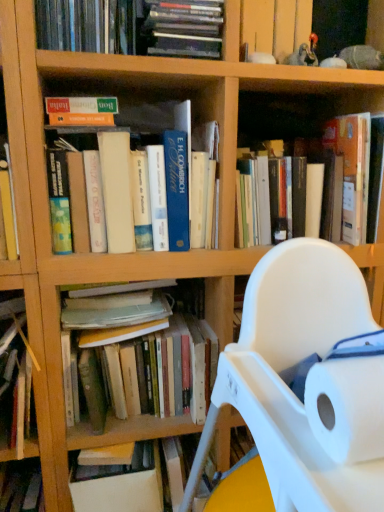
Question: Does hardcover books at upper center, the 6th book from the bottom, have a lesser height compared to white paper at right?

Choices:
 (A) yes
 (B) no

Answer: (B)

Question: Can you confirm if hardcover books at upper center, the 6th book from the bottom, is wider than white paper at right?

Choices:
 (A) no
 (B) yes

Answer: (B)

Question: From a real-world perspective, is hardcover books at upper center, the 6th book from the bottom, physically below white paper at right?

Choices:
 (A) yes
 (B) no

Answer: (B)

Question: Is hardcover books at upper center, the 6th book from the bottom, to the left of white paper at right from the viewer's perspective?

Choices:
 (A) yes
 (B) no

Answer: (A)

Question: Can you confirm if hardcover books at upper center, the 6th book from the bottom, is bigger than white paper at right?

Choices:
 (A) yes
 (B) no

Answer: (A)

Question: Is hardcover books at upper center, the 6th book from the bottom, touching white paper at right?

Choices:
 (A) yes
 (B) no

Answer: (B)

Question: Is hardcover book at center, the fourth book ordered from the bottom, shorter than wooden shelf at upper right?

Choices:
 (A) no
 (B) yes

Answer: (A)

Question: Is hardcover book at center, the 3th book positioned from the top, directly adjacent to wooden shelf at upper right?

Choices:
 (A) yes
 (B) no

Answer: (B)

Question: From a real-world perspective, is hardcover book at center, the fourth book ordered from the bottom, physically below wooden shelf at upper right?

Choices:
 (A) yes
 (B) no

Answer: (A)

Question: Can you confirm if hardcover book at center, the 3th book positioned from the top, is smaller than wooden shelf at upper right?

Choices:
 (A) no
 (B) yes

Answer: (A)

Question: Considering the relative positions of hardcover book at center, the 3th book positioned from the top, and wooden shelf at upper right in the image provided, is hardcover book at center, the 3th book positioned from the top, behind wooden shelf at upper right?

Choices:
 (A) yes
 (B) no

Answer: (B)

Question: Does hardcover book at center, the fourth book ordered from the bottom, contain wooden shelf at upper right?

Choices:
 (A) yes
 (B) no

Answer: (B)

Question: Is hardcover book at center, the fourth book ordered from the bottom, at the right side of hardcover books at upper center, the 6th book from the bottom?

Choices:
 (A) no
 (B) yes

Answer: (B)